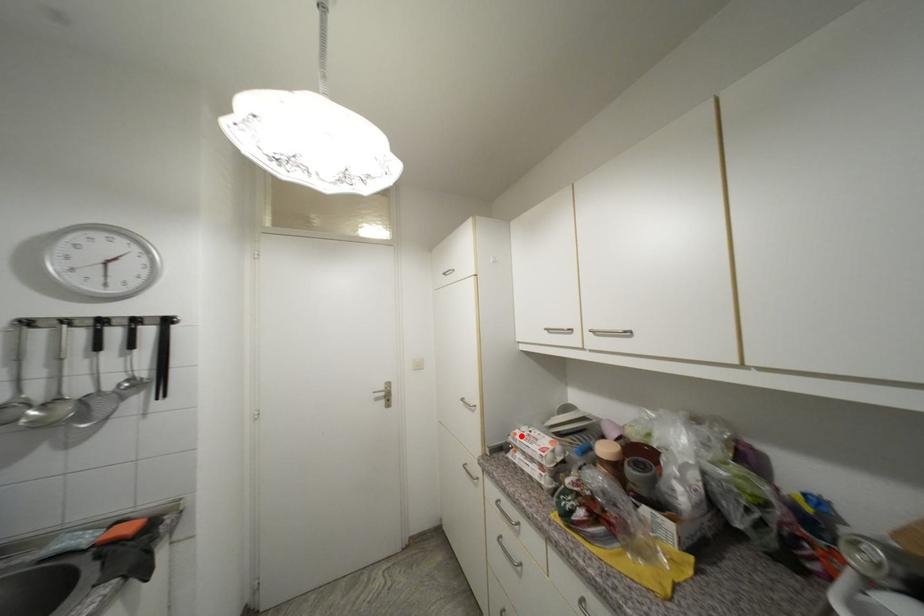
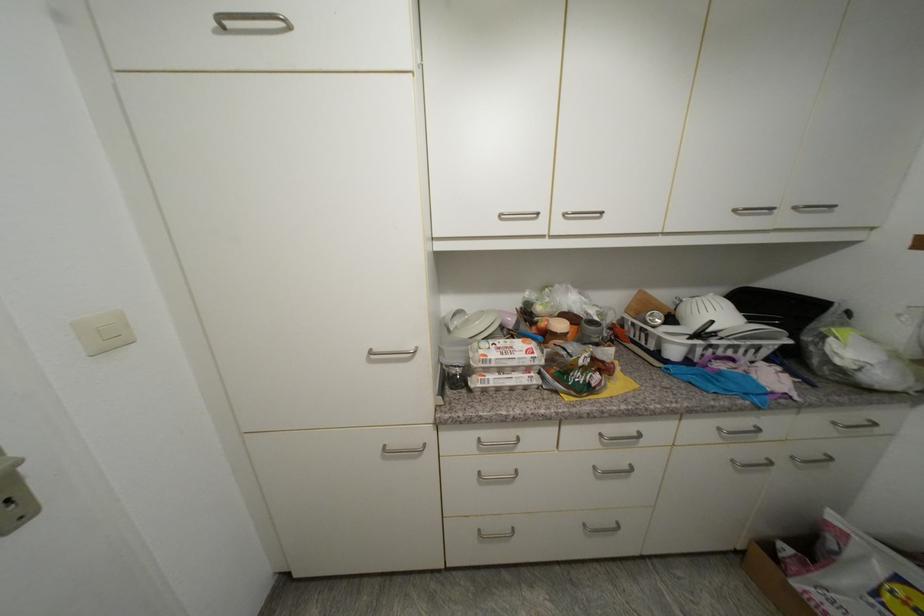
Question: I am providing you with two images of the same scene from different viewpoints. A red point is marked on the first image. Is the red point's position out of view in image 2?

Choices:
 (A) Yes
 (B) No

Answer: (B)